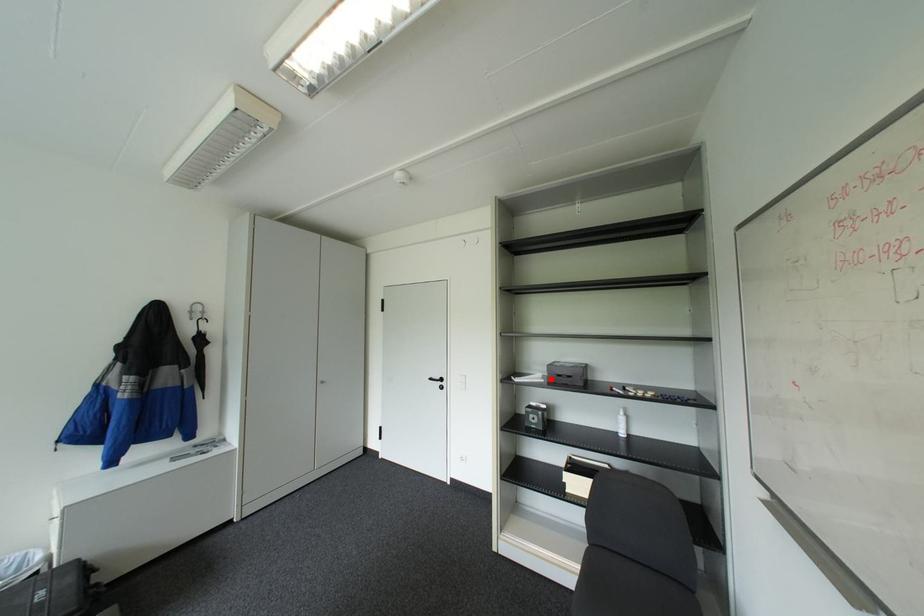
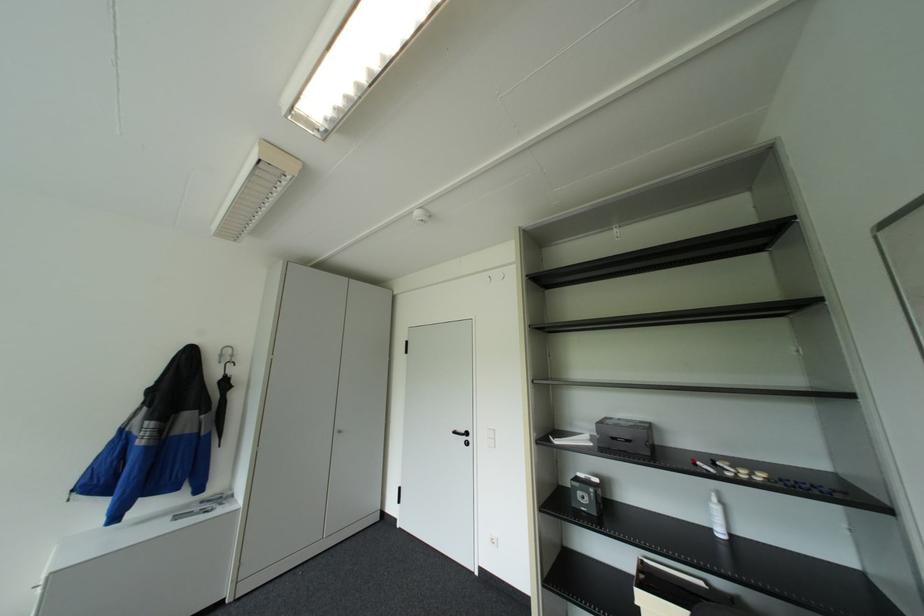
The point at the highlighted location is marked in the first image. Where is the corresponding point in the second image?

(600, 443)